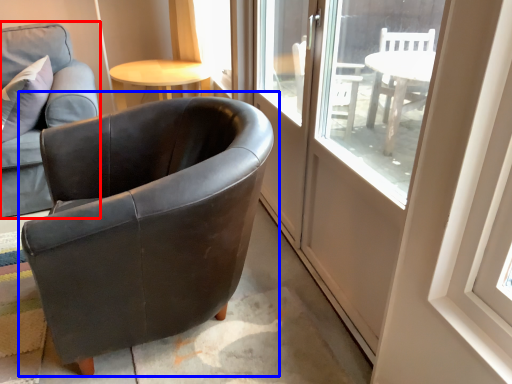
Question: Which point is closer to the camera, chair (highlighted by a red box) or chair (highlighted by a blue box)?

Choices:
 (A) chair
 (B) chair

Answer: (B)